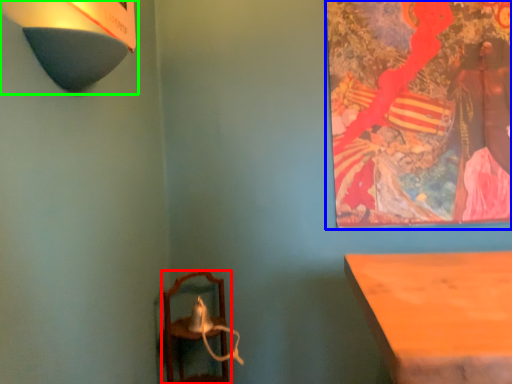
Question: Which is nearer to the furniture (highlighted by a red box)? picture frame (highlighted by a blue box) or lamp (highlighted by a green box).

Choices:
 (A) picture frame
 (B) lamp

Answer: (A)